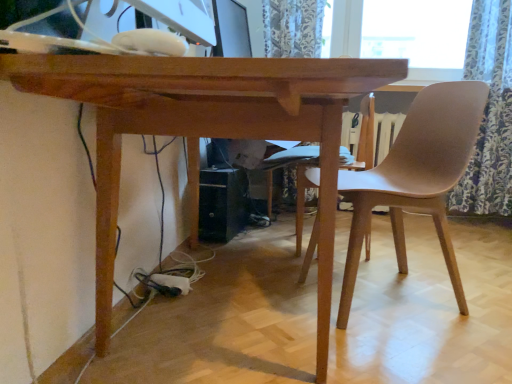
This screenshot has height=384, width=512. I want to click on vacant region below wooden table at center (from a real-world perspective), so click(236, 294).